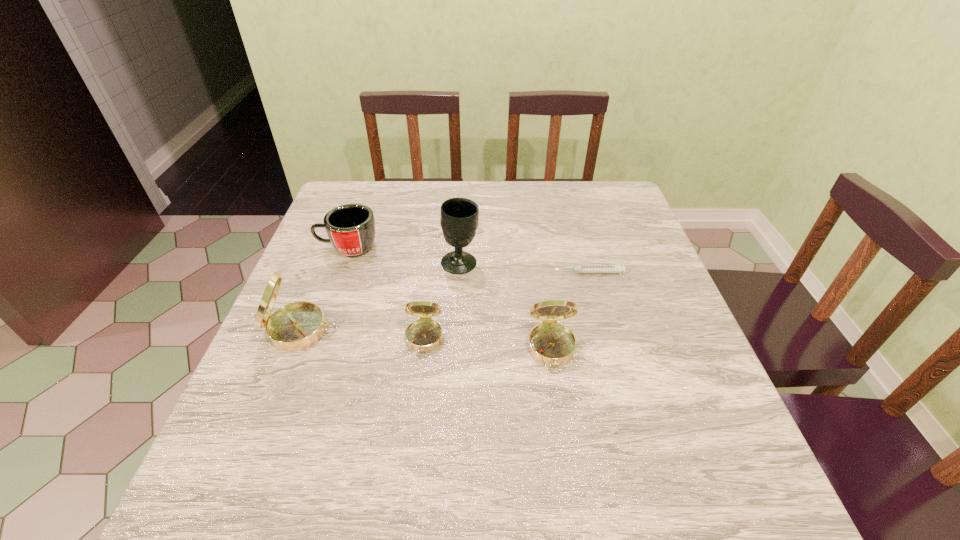
Choose which object is the nearest neighbor to the chalice. Please provide its 2D coordinates. Your answer should be formatted as a tuple, i.e. [(x, y)], where the tuple contains the x and y coordinates of a point satisfying the conditions above.

[(425, 334)]

In order to click on compass identified as the closest to the mug in this screenshot , I will do `click(296, 326)`.

Find the location of a particular element. The height and width of the screenshot is (540, 960). the third closest compass relative to the chalice is located at coordinates (296, 326).

You are a GUI agent. You are given a task and a screenshot of the screen. Output one action in this format:
    pyautogui.click(x=<x>, y=<y>)
    Task: Click on the free region that satisfies the following two spatial constraints: 1. at the needle end of the syringe; 2. with the dial facing the second tallest compass
    Image resolution: width=960 pixels, height=540 pixels.
    Given the screenshot: What is the action you would take?
    pyautogui.click(x=610, y=349)

At what (x,y) coordinates should I click in order to perform the action: click on free space that satisfies the following two spatial constraints: 1. at the needle end of the syringe; 2. with the dial facing the third tallest object. Please return your answer as a coordinate pair (x, y). The width and height of the screenshot is (960, 540). Looking at the image, I should click on (610, 349).

I want to click on free spot that satisfies the following two spatial constraints: 1. on the back side of the chalice; 2. on the side of the mug with the handle, so click(x=461, y=247).